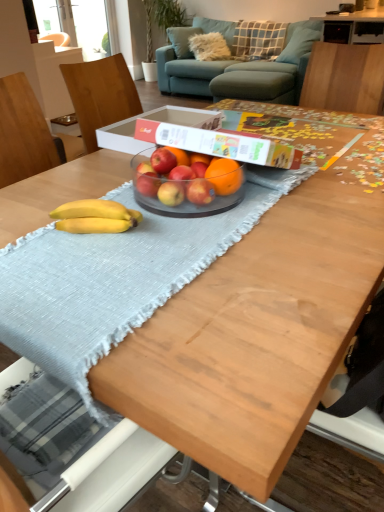
The image size is (384, 512). I want to click on blank space to the left of red matte apple at center, acting as the fourth apple starting from the left, so click(x=127, y=199).